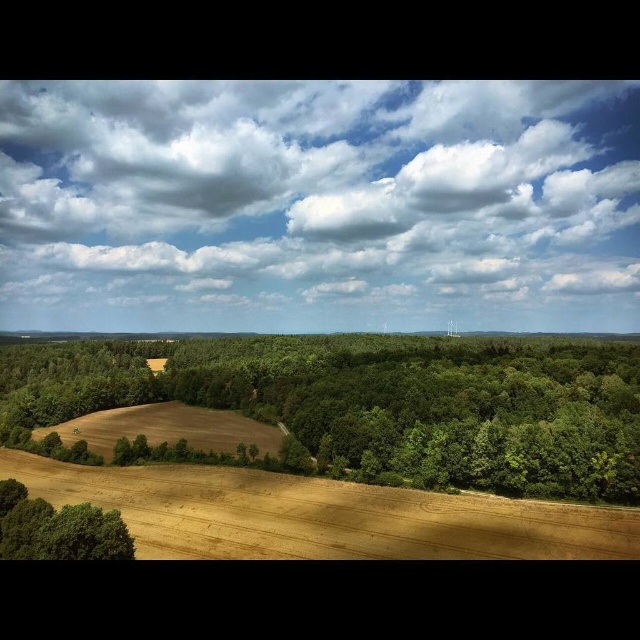
Who is higher up, green leafy trees at center or golden dry wheat field at lower center?

green leafy trees at center

Between green leafy trees at center and golden dry wheat field at lower center, which one is positioned lower?

golden dry wheat field at lower center is below.

In the scene shown: Measure the distance between point (481, 422) and camera.

Point (481, 422) is 126.43 meters away from camera.

Where is `green leafy trees at center`? This screenshot has height=640, width=640. green leafy trees at center is located at coordinates (376, 403).

Does white fluffy cloud at upper center have a larger size compared to golden dry wheat field at lower center?

Indeed, white fluffy cloud at upper center has a larger size compared to golden dry wheat field at lower center.

This screenshot has height=640, width=640. What do you see at coordinates (317, 204) in the screenshot?
I see `white fluffy cloud at upper center` at bounding box center [317, 204].

Which is behind, point (413, 212) or point (179, 528)?

The point (413, 212) is more distant.

Identify the location of white fluffy cloud at upper center. (x=317, y=204).

Is green leafy trees at center shorter than green leafy tree at lower left?

In fact, green leafy trees at center may be taller than green leafy tree at lower left.

Can you confirm if green leafy trees at center is smaller than green leafy tree at lower left?

Incorrect, green leafy trees at center is not smaller in size than green leafy tree at lower left.

At what (x,y) coordinates should I click in order to perform the action: click on green leafy trees at center. Please return your answer as a coordinate pair (x, y). Looking at the image, I should click on click(x=376, y=403).